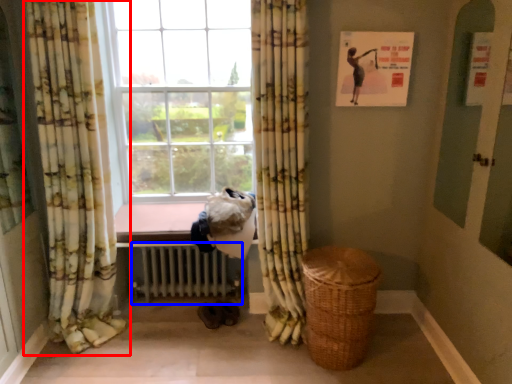
Question: Which object is closer to the camera taking this photo, curtain (highlighted by a red box) or radiator (highlighted by a blue box)?

Choices:
 (A) curtain
 (B) radiator

Answer: (A)